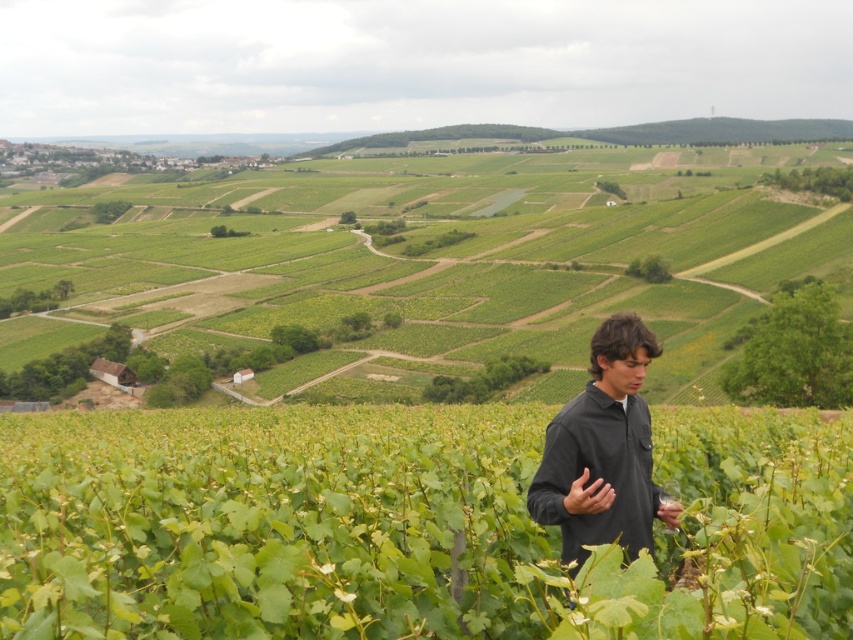
Based on the scene, which object is shorter between the green leafy vines at center and the green leafy vineyard at lower center?

The green leafy vines at center is shorter than the green leafy vineyard at lower center because the description states that the green leafy vines at center is not as tall as the green leafy vineyard at lower center.

You are standing at the point marked by the man in the vineyard and want to walk to the point labeled point (80, 321). Which direction should you move relative to point (712, 609)?

You should move away from point (712, 609) because point (80, 321) is further from the camera than point (712, 609).

You are a photographer planning to capture a wide shot of the scene. Considering the green leafy vineyard at lower center and the black matte shirt at center, which object would occupy more space in the photo?

The green leafy vineyard at lower center occupies more space in the photo because it has a larger size compared to the black matte shirt at center.